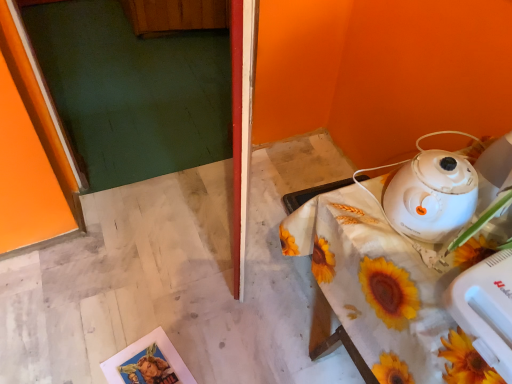
You are a GUI agent. You are given a task and a screenshot of the screen. Output one action in this format:
    pyautogui.click(x=<x>, y=<y>)
    Task: Click on the free space that is in between white plastic mixer at lower right and white glossy kettle at upper right
    
    Given the screenshot: What is the action you would take?
    pyautogui.click(x=433, y=260)